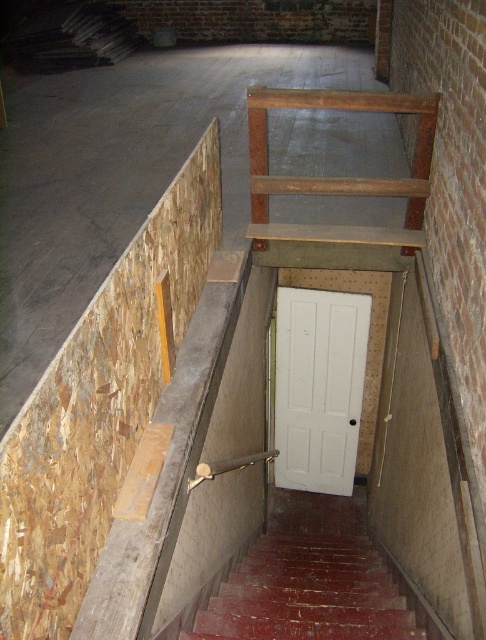
You are a contractor assessing the space. You need to determine if the wooden at upper center can fit on top of the rusty metal stairs at lower center. Based on their sizes, what is your assessment?

The rusty metal stairs at lower center has a larger size compared to wooden at upper center, so the wooden at upper center can fit on top of the rusty metal stairs at lower center since it is smaller in size.

You are standing at the entrance of the staircase and want to locate the white painted wood door at center. Based on the coordinates provided, where should you look relative to the staircase?

The white painted wood door at center is located at coordinates point (318,387), which means it is positioned to the right and slightly above the staircase entrance.

You are standing at the bottom of the staircase in the unfinished basement area. You see two points marked on the wall. The first point is at coordinates point (x=215, y=595) and the second is at point (x=364, y=344). Which point is closer to you?

Point (x=215, y=595) is closer to the camera than point (x=364, y=344), so the first point is closer to you.